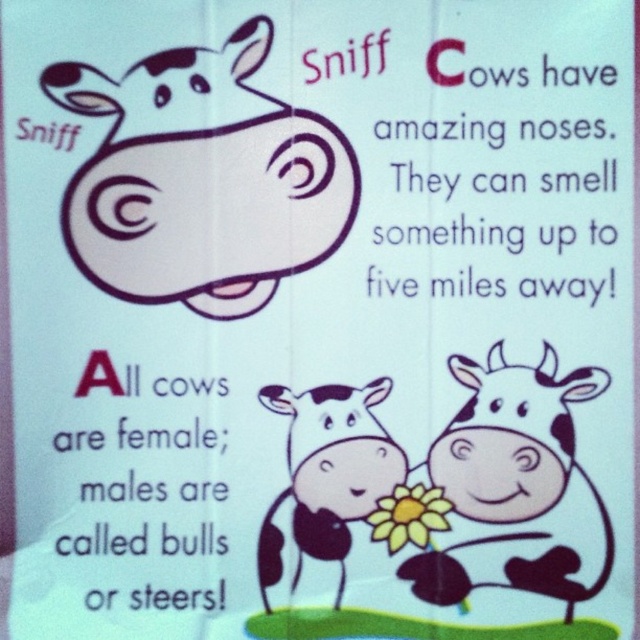
Question: Is black and white spotted cow at center smaller than black paper text at lower center?

Choices:
 (A) no
 (B) yes

Answer: (B)

Question: Is the position of black and white spotted cow at center less distant than that of yellow matte flower at center?

Choices:
 (A) no
 (B) yes

Answer: (B)

Question: Which is nearer to the white matte cow at upper left?

Choices:
 (A) black paper text at lower center
 (B) black paper text at upper right
 (C) white spotted cow at lower right

Answer: (A)

Question: Which point appears closest to the camera in this image?

Choices:
 (A) (545, 440)
 (B) (404, 499)

Answer: (A)

Question: Which of the following is the closest to the observer?

Choices:
 (A) white spotted cow at lower right
 (B) black paper text at lower center
 (C) yellow matte flower at center

Answer: (A)

Question: Is black and white spotted cow at center to the left of black paper text at lower center from the viewer's perspective?

Choices:
 (A) no
 (B) yes

Answer: (A)